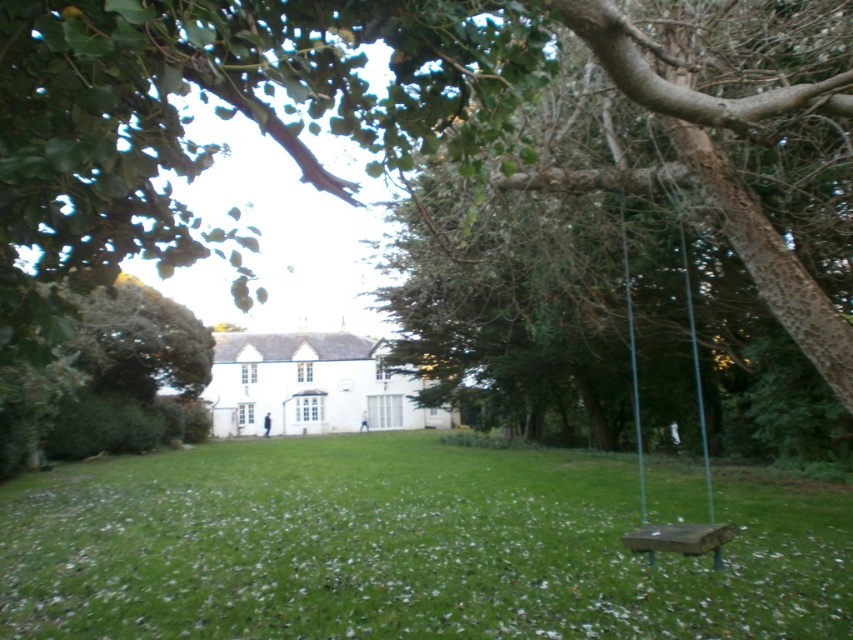
You are standing on the green grass at lower center and want to reach the smooth bark tree at center. Which direction should you move to get closer to the tree?

The smooth bark tree at center is located above the green grass at lower center, so you should move upward to get closer to the tree.

You are standing on the lawn with small white petals, looking at the smooth bark tree at center and the wooden swing at right. Which object is taller?

The smooth bark tree at center is much taller than the wooden swing at right.

You are standing on the green grass at lower center and want to reach the wooden swing at right. Which direction should you walk to get there?

Since the green grass at lower center is located below the wooden swing at right, you should walk upwards toward the wooden swing at right to reach it.